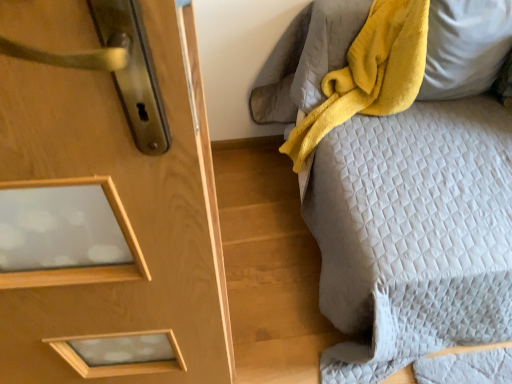
Describe the element at coordinates (465, 47) in the screenshot. The height and width of the screenshot is (384, 512). I see `yellow soft pillow at upper right` at that location.

You are a GUI agent. You are given a task and a screenshot of the screen. Output one action in this format:
    pyautogui.click(x=<x>, y=<y>)
    Task: Click on the yellow plush blanket at upper right
    
    Given the screenshot: What is the action you would take?
    tap(369, 74)

Is point (323, 142) positioned before point (392, 34)?

No, it is behind (392, 34).

Which object is positioned more to the left, quilted gray bedspread at right or yellow plush blanket at upper right?

yellow plush blanket at upper right.

Is quilted gray bedspread at right facing towards yellow plush blanket at upper right?

No, quilted gray bedspread at right is not turned towards yellow plush blanket at upper right.

Is quilted gray bedspread at right at the back of yellow plush blanket at upper right?

Yes, yellow plush blanket at upper right is facing away from quilted gray bedspread at right.

The image size is (512, 384). What are the coordinates of `blanket above the quilted gray bedspread at right (from the image's perspective)` in the screenshot? It's located at (369, 74).

Which is more to the left, yellow plush blanket at upper right or quilted gray bedspread at right?

yellow plush blanket at upper right.

Considering the sizes of objects yellow plush blanket at upper right and quilted gray bedspread at right in the image provided, who is bigger, yellow plush blanket at upper right or quilted gray bedspread at right?

With larger size is quilted gray bedspread at right.

From a real-world perspective, is yellow soft pillow at upper right beneath yellow plush blanket at upper right?

No.

In the image, is yellow soft pillow at upper right positioned in front of or behind yellow plush blanket at upper right?

yellow soft pillow at upper right is positioned farther from the viewer than yellow plush blanket at upper right.

Is yellow soft pillow at upper right to the right of yellow plush blanket at upper right from the viewer's perspective?

Correct, you'll find yellow soft pillow at upper right to the right of yellow plush blanket at upper right.

In terms of size, does yellow soft pillow at upper right appear bigger or smaller than yellow plush blanket at upper right?

Clearly, yellow soft pillow at upper right is smaller in size than yellow plush blanket at upper right.

Does point (406, 28) come in front of point (457, 61)?

Yes, it is.

Which of these two, yellow plush blanket at upper right or yellow soft pillow at upper right, is thinner?

With smaller width is yellow soft pillow at upper right.

Is yellow plush blanket at upper right far away from yellow soft pillow at upper right?

yellow plush blanket at upper right is near yellow soft pillow at upper right, not far away.

I want to click on blanket below the yellow soft pillow at upper right (from the image's perspective), so click(x=369, y=74).

Is yellow soft pillow at upper right wider than quilted gray bedspread at right?

Incorrect, the width of yellow soft pillow at upper right does not surpass that of quilted gray bedspread at right.

Can you confirm if yellow soft pillow at upper right is bigger than quilted gray bedspread at right?

Incorrect, yellow soft pillow at upper right is not larger than quilted gray bedspread at right.

In terms of height, does yellow soft pillow at upper right look taller or shorter compared to quilted gray bedspread at right?

In the image, yellow soft pillow at upper right appears to be shorter than quilted gray bedspread at right.

Choose the correct answer: Is yellow soft pillow at upper right inside quilted gray bedspread at right or outside it?

yellow soft pillow at upper right fits inside quilted gray bedspread at right.

Is quilted gray bedspread at right next to yellow soft pillow at upper right?

quilted gray bedspread at right and yellow soft pillow at upper right are clearly separated.

Which of these two, quilted gray bedspread at right or yellow soft pillow at upper right, stands taller?

Standing taller between the two is quilted gray bedspread at right.

What's the angular difference between quilted gray bedspread at right and yellow soft pillow at upper right's facing directions?

The angular difference between quilted gray bedspread at right and yellow soft pillow at upper right is 3.42 degrees.

From the picture: Visually, is quilted gray bedspread at right positioned to the left or to the right of yellow soft pillow at upper right?

Clearly, quilted gray bedspread at right is on the left of yellow soft pillow at upper right in the image.

Where is `furniture in front of the yellow plush blanket at upper right`? The image size is (512, 384). furniture in front of the yellow plush blanket at upper right is located at coordinates (399, 201).

This screenshot has width=512, height=384. I want to click on furniture below the yellow plush blanket at upper right (from a real-world perspective), so click(x=399, y=201).

When comparing their distances from yellow plush blanket at upper right, does yellow soft pillow at upper right or quilted gray bedspread at right seem further?

quilted gray bedspread at right is positioned further to the anchor yellow plush blanket at upper right.

Considering their positions, is quilted gray bedspread at right positioned further to yellow soft pillow at upper right than yellow plush blanket at upper right?

quilted gray bedspread at right.

When comparing their distances from yellow plush blanket at upper right, does quilted gray bedspread at right or yellow soft pillow at upper right seem further?

→ quilted gray bedspread at right is further to yellow plush blanket at upper right.

Looking at the image, which one is located closer to quilted gray bedspread at right, yellow plush blanket at upper right or yellow soft pillow at upper right?

yellow plush blanket at upper right is positioned closer to the anchor quilted gray bedspread at right.

From the picture: Which object lies nearer to the anchor point quilted gray bedspread at right, yellow soft pillow at upper right or yellow plush blanket at upper right?

yellow plush blanket at upper right lies closer to quilted gray bedspread at right than the other object.

Considering their positions, is yellow plush blanket at upper right positioned closer to yellow soft pillow at upper right than quilted gray bedspread at right?

Among the two, yellow plush blanket at upper right is located nearer to yellow soft pillow at upper right.

Find the location of a particular element. The image size is (512, 384). blanket between quilted gray bedspread at right and yellow soft pillow at upper right in the front-back direction is located at coordinates (369, 74).